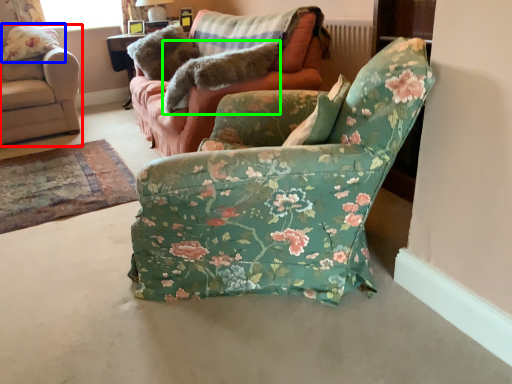
Question: Which is nearer to the chair (highlighted by a red box)? pillow (highlighted by a blue box) or animal (highlighted by a green box).

Choices:
 (A) pillow
 (B) animal

Answer: (A)